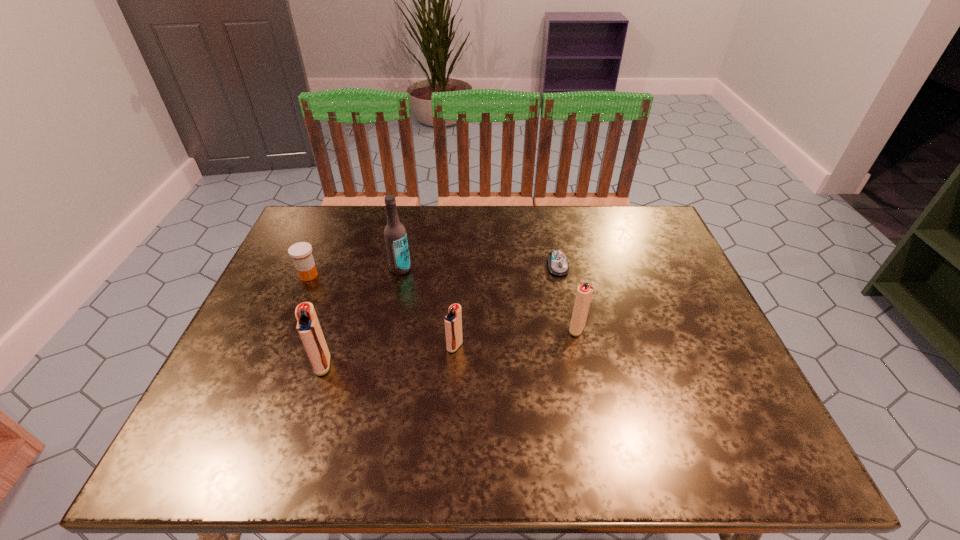
The image size is (960, 540). Identify the location of vacant space located 0.070m on the back of the second object from left to right. (334, 330).

The width and height of the screenshot is (960, 540). I want to click on vacant region located 0.320m on the back of the shortest igniter, so click(x=460, y=254).

Identify the location of free space located 0.170m on the left of the second shortest igniter. Image resolution: width=960 pixels, height=540 pixels. (498, 329).

This screenshot has width=960, height=540. What are the coordinates of `free location located on the label of the beer bottle` in the screenshot? It's located at [381, 364].

Locate an element on the screen. free location located 0.090m on the wheel side of the shortest object is located at coordinates (564, 300).

I want to click on free space located 0.090m on the label of the medicine, so click(x=295, y=307).

This screenshot has width=960, height=540. What are the coordinates of `object located in the left edge section of the desktop` in the screenshot? It's located at (301, 252).

Where is `vacant space at the far edge of the desktop`? vacant space at the far edge of the desktop is located at coordinates (x=412, y=217).

Image resolution: width=960 pixels, height=540 pixels. In the image, there is a desktop. In order to click on free space at the near edge in this screenshot , I will do `click(310, 386)`.

The height and width of the screenshot is (540, 960). In the image, there is a desktop. In order to click on vacant region at the left edge in this screenshot , I will do `click(301, 284)`.